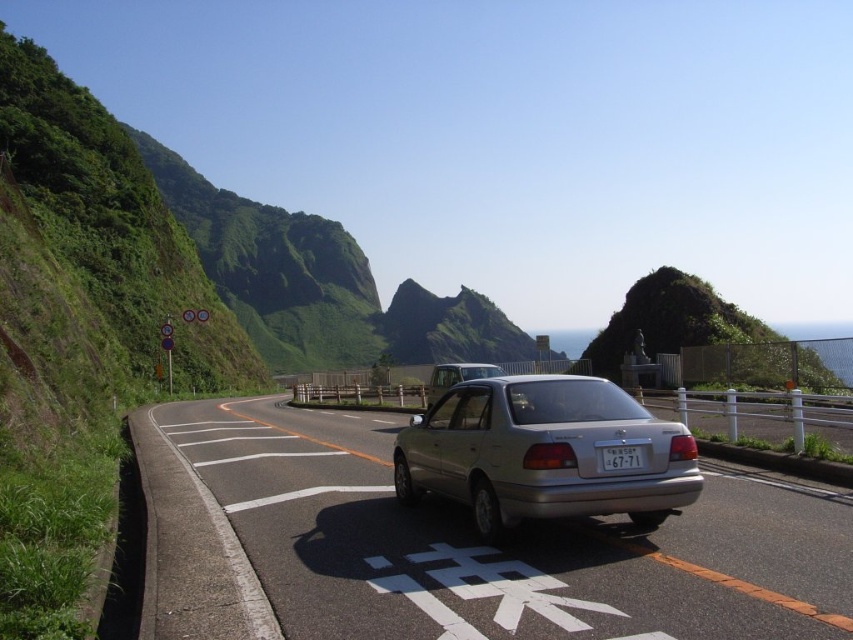
Question: Can you confirm if metallic silver car at center is smaller than white plastic license plate at center?

Choices:
 (A) no
 (B) yes

Answer: (A)

Question: Can you confirm if metallic silver car at center is smaller than white plastic license plate at center?

Choices:
 (A) yes
 (B) no

Answer: (B)

Question: Which point is closer to the camera?

Choices:
 (A) (558, 506)
 (B) (440, 396)
 (C) (171, 417)

Answer: (A)

Question: Considering the real-world distances, which object is closest to the satin silver sedan at center?

Choices:
 (A) silver metallic car at center
 (B) white plastic license plate at center

Answer: (A)

Question: Which point is closer to the camera taking this photo?

Choices:
 (A) (601, 390)
 (B) (408, 561)

Answer: (B)

Question: Does silver metallic car at center come behind metallic silver car at center?

Choices:
 (A) yes
 (B) no

Answer: (B)